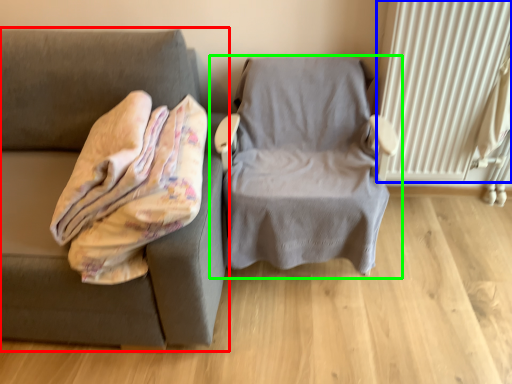
Question: Which object is the closest to the studio couch (highlighted by a red box)? Choose among these: radiator (highlighted by a blue box) or chair (highlighted by a green box).

Choices:
 (A) radiator
 (B) chair

Answer: (B)